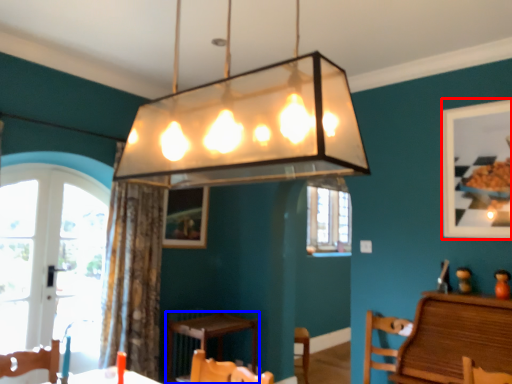
Question: Among these objects, which one is nearest to the camera, picture frame (highlighted by a red box) or table (highlighted by a blue box)?

Choices:
 (A) picture frame
 (B) table

Answer: (A)